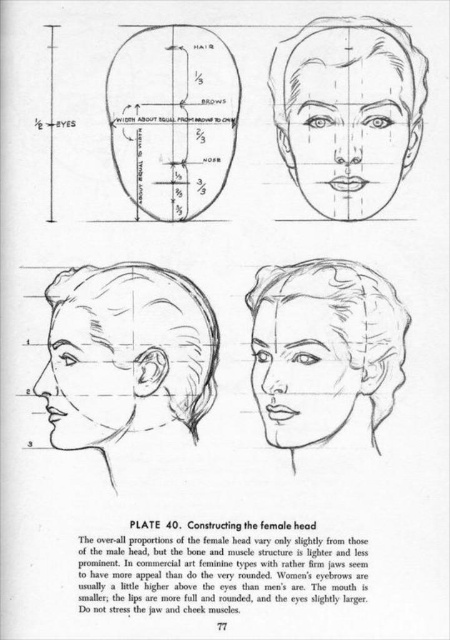
Is smooth skin face at upper center closer to camera compared to matte black ear at lower left?

Yes, it is.

Find the location of a particular element. The height and width of the screenshot is (640, 450). smooth skin face at upper center is located at coordinates (347, 112).

Is point (283, 134) farther from viewer compared to point (89, 419)?

Yes, point (283, 134) is farther from viewer.

Find the location of `smooth skin face at upper center`. smooth skin face at upper center is located at coordinates (347, 112).

How far apart are smooth skin face at center and matte black ear at lower left?

smooth skin face at center is 9.70 inches from matte black ear at lower left.

Find the location of a particular element. The height and width of the screenshot is (640, 450). smooth skin face at center is located at coordinates [x=324, y=348].

Is point (259, 372) farther from camera compared to point (103, 435)?

Yes, it is behind point (103, 435).

Find the location of a particular element. The height and width of the screenshot is (640, 450). smooth skin face at center is located at coordinates (324, 348).

Can you confirm if smooth skin head at lower left is wider than smooth skin face at upper center?

Indeed, smooth skin head at lower left has a greater width compared to smooth skin face at upper center.

At what (x,y) coordinates should I click in order to perform the action: click on smooth skin head at lower left. Please return your answer as a coordinate pair (x, y). The height and width of the screenshot is (640, 450). Looking at the image, I should click on (126, 353).